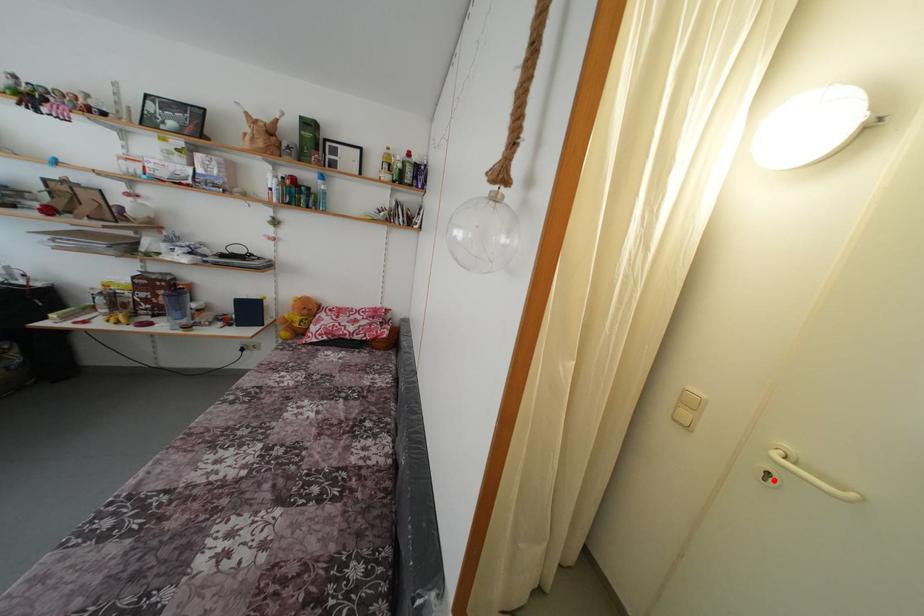
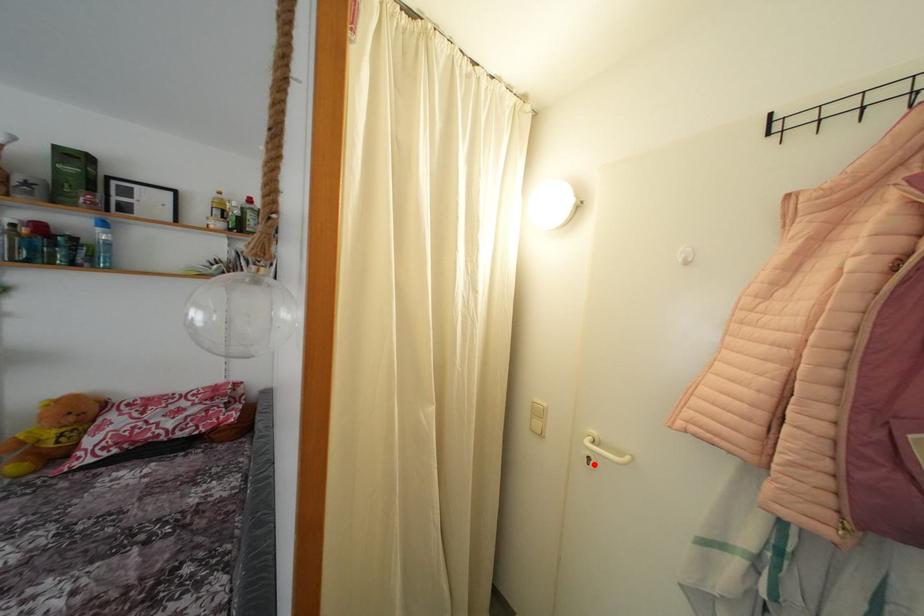
I am providing you with two images of the same scene from different viewpoints. A red point is marked on the first image and another point is marked on the second image. Does the point marked in image1 correspond to the same location as the one in image2?

Yes